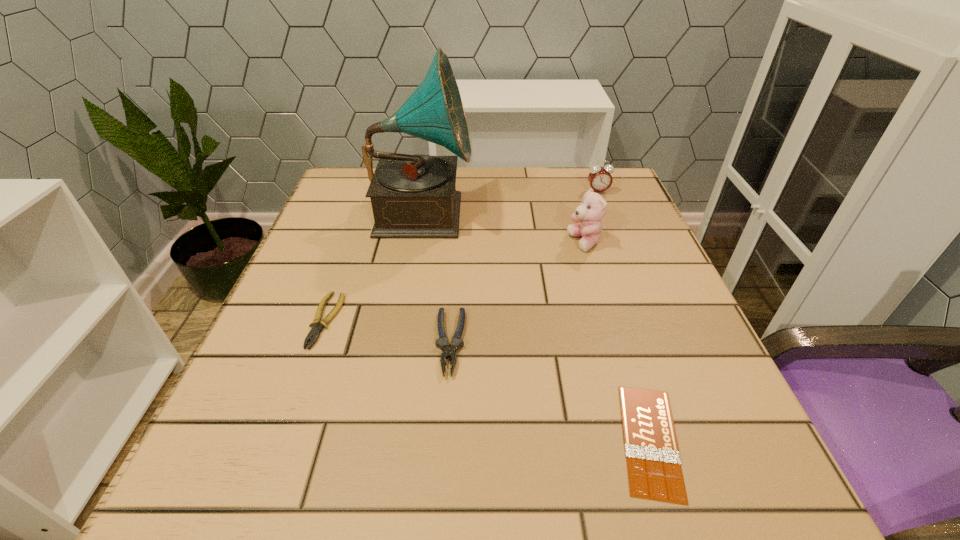
The width and height of the screenshot is (960, 540). I want to click on free space between the record player and the fourth shortest object, so click(511, 201).

You are a GUI agent. You are given a task and a screenshot of the screen. Output one action in this format:
    pyautogui.click(x=<x>, y=<y>)
    Task: Click on the free space between the nearest object and the right pliers
    This screenshot has height=540, width=960.
    Given the screenshot: What is the action you would take?
    pyautogui.click(x=550, y=392)

The image size is (960, 540). What are the coordinates of `free spot between the right pliers and the chocolate bar` in the screenshot? It's located at [x=550, y=392].

What are the coordinates of `free spot between the third shortest object and the third tallest object` in the screenshot? It's located at (524, 267).

This screenshot has height=540, width=960. I want to click on the fourth closest object to the chocolate bar, so click(317, 325).

Point out which object is positioned as the second nearest to the shorter pliers. Please provide its 2D coordinates. Your answer should be formatted as a tuple, i.e. [(x, y)], where the tuple contains the x and y coordinates of a point satisfying the conditions above.

[(448, 351)]

Where is `blank area in the image that satisfies the following two spatial constraints: 1. at the face of the second tallest object; 2. on the left side of the shortest object`? This screenshot has width=960, height=540. blank area in the image that satisfies the following two spatial constraints: 1. at the face of the second tallest object; 2. on the left side of the shortest object is located at coordinates (643, 440).

You are a GUI agent. You are given a task and a screenshot of the screen. Output one action in this format:
    pyautogui.click(x=<x>, y=<y>)
    Task: Click on the vacant position in the image that satisfies the following two spatial constraints: 1. at the face of the fifth shortest object; 2. on the left side of the nearest object
    This screenshot has width=960, height=540.
    Given the screenshot: What is the action you would take?
    pyautogui.click(x=643, y=440)

In order to click on vacant space that satisfies the following two spatial constraints: 1. at the face of the second tallest object; 2. on the back side of the nearest object in this screenshot , I will do `click(643, 440)`.

Locate an element on the screen. Image resolution: width=960 pixels, height=540 pixels. free space that satisfies the following two spatial constraints: 1. on the clock face of the alarm clock; 2. on the horn of the tallest object is located at coordinates (606, 212).